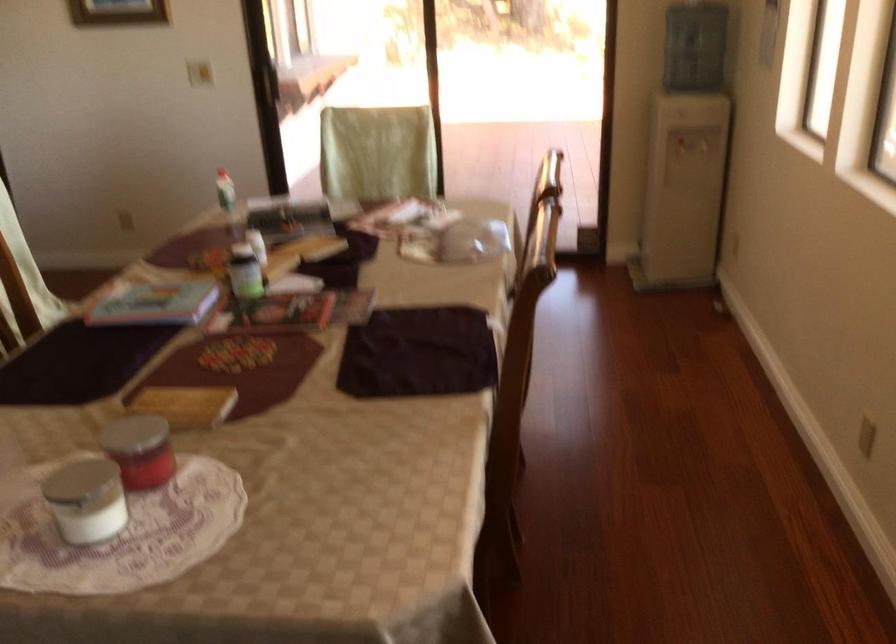
The location [245,272] corresponds to which object?

It corresponds to the dark pill bottle in the image.